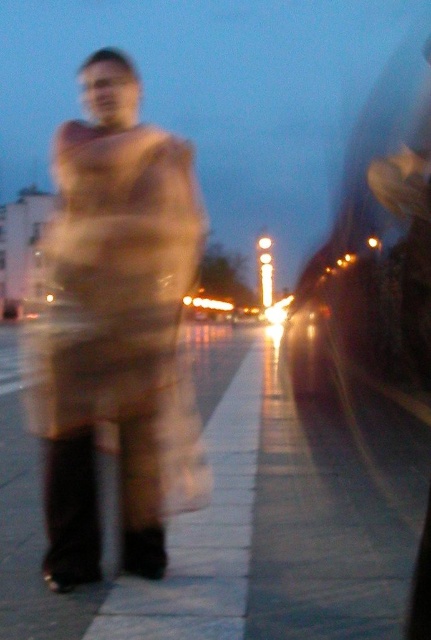
You are a photographer trying to capture the beige wool coat at center and the smooth concrete sidewalk at center in a new shot. Based on their relative heights, which object should you focus on to ensure both are in frame without cropping?

The beige wool coat at center is much taller than the smooth concrete sidewalk at center, so focusing on the beige wool coat at center will ensure both are in frame without cropping.

You are a photographer trying to capture the beige wool coat at center and the smooth concrete sidewalk at center in a clear photo. Considering the current lighting conditions, which object would be easier to focus on and why?

The beige wool coat at center is larger in size than the smooth concrete sidewalk at center, making it easier to focus on due to its larger surface area and motion blur from the person walking.